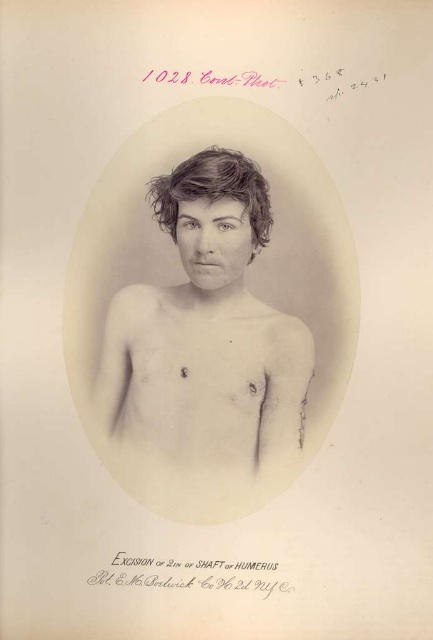
Question: Is smooth skin torso at center above dark brown wavy hair at center?

Choices:
 (A) no
 (B) yes

Answer: (A)

Question: Among these objects, which one is nearest to the camera?

Choices:
 (A) smooth skin torso at center
 (B) dark brown wavy hair at center

Answer: (B)

Question: From the image, what is the correct spatial relationship of smooth skin torso at center in relation to dark brown wavy hair at center?

Choices:
 (A) left
 (B) right

Answer: (A)

Question: In this image, where is smooth skin torso at center located relative to dark brown wavy hair at center?

Choices:
 (A) left
 (B) right

Answer: (A)

Question: Which point is farther from the camera taking this photo?

Choices:
 (A) (245, 400)
 (B) (254, 177)

Answer: (A)